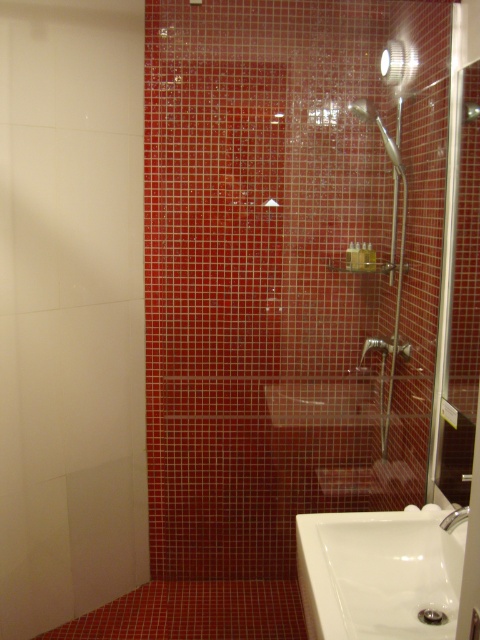
Where is `white glossy sink at lower right`? This screenshot has width=480, height=640. white glossy sink at lower right is located at coordinates (379, 573).

Between white glossy sink at lower right and metallic silver shower head at upper center, which one is positioned higher?

Answer: metallic silver shower head at upper center

What are the coordinates of `white glossy sink at lower right` in the screenshot? It's located at (379, 573).

Does transparent glass shower door at center have a smaller size compared to matte silver faucet at lower right?

Incorrect, transparent glass shower door at center is not smaller in size than matte silver faucet at lower right.

This screenshot has width=480, height=640. Identify the location of transparent glass shower door at center. (294, 269).

Between point (349, 548) and point (442, 518), which one is positioned behind?

Positioned behind is point (442, 518).

Where is `white glossy sink at lower right`? The width and height of the screenshot is (480, 640). white glossy sink at lower right is located at coordinates (379, 573).

Where is `white glossy sink at lower right`? white glossy sink at lower right is located at coordinates (379, 573).